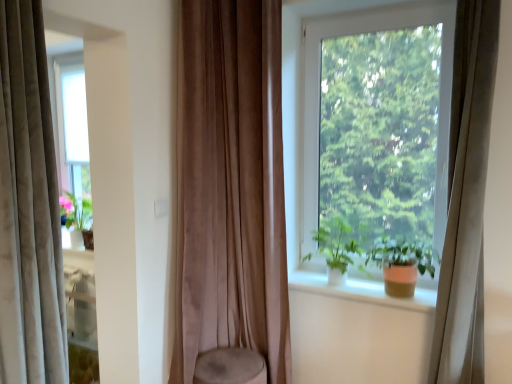
Question: Is transparent glass window at center touching white smooth window sill at center?

Choices:
 (A) yes
 (B) no

Answer: (B)

Question: Considering the relative sizes of transparent glass window at center and white smooth window sill at center in the image provided, is transparent glass window at center bigger than white smooth window sill at center?

Choices:
 (A) no
 (B) yes

Answer: (B)

Question: From the image's perspective, is transparent glass window at center located beneath white smooth window sill at center?

Choices:
 (A) no
 (B) yes

Answer: (A)

Question: Is transparent glass window at center aimed at white smooth window sill at center?

Choices:
 (A) no
 (B) yes

Answer: (B)

Question: Does transparent glass window at center have a smaller size compared to white smooth window sill at center?

Choices:
 (A) no
 (B) yes

Answer: (A)

Question: Is transparent glass window at center taller than white smooth window sill at center?

Choices:
 (A) no
 (B) yes

Answer: (B)

Question: Is transparent glass window at center with green matte plant at window?

Choices:
 (A) yes
 (B) no

Answer: (B)

Question: From a real-world perspective, is transparent glass window at center under green matte plant at window?

Choices:
 (A) yes
 (B) no

Answer: (B)

Question: Is transparent glass window at center smaller than green matte plant at window?

Choices:
 (A) no
 (B) yes

Answer: (A)

Question: From the image's perspective, is transparent glass window at center located beneath green matte plant at window?

Choices:
 (A) no
 (B) yes

Answer: (A)

Question: Does transparent glass window at center have a greater height compared to green matte plant at window?

Choices:
 (A) no
 (B) yes

Answer: (B)

Question: Is green matte plant at window located within transparent glass window at center?

Choices:
 (A) no
 (B) yes

Answer: (A)

Question: From the image's perspective, would you say transparent glass window at center is shown under matte orange pot at window?

Choices:
 (A) no
 (B) yes

Answer: (A)